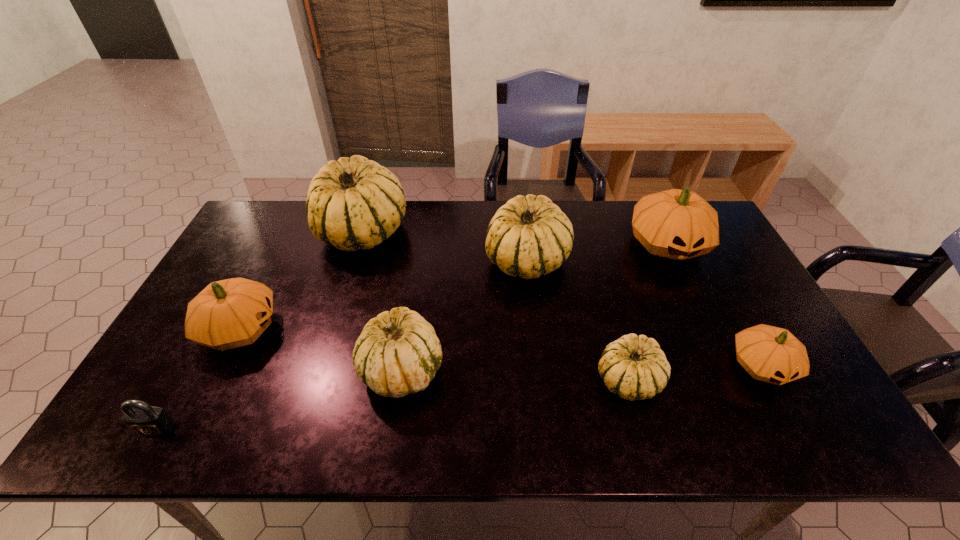
Identify which orange gourd is located as the second nearest to the biggest orange gourd. Please provide its 2D coordinates. Your answer should be formatted as a tuple, i.e. [(x, y)], where the tuple contains the x and y coordinates of a point satisfying the conditions above.

[(230, 313)]

You are a GUI agent. You are given a task and a screenshot of the screen. Output one action in this format:
    pyautogui.click(x=<x>, y=<y>)
    Task: Click on the orange gourd that is the second closest to the second smallest orange gourd
    The image size is (960, 540).
    Given the screenshot: What is the action you would take?
    pyautogui.click(x=770, y=354)

You are a GUI agent. You are given a task and a screenshot of the screen. Output one action in this format:
    pyautogui.click(x=<x>, y=<y>)
    Task: Click on the free location that satisfies the following two spatial constraints: 1. on the front side of the biggest white gourd; 2. on the right side of the fourth gourd from left to right
    Image resolution: width=960 pixels, height=540 pixels.
    Given the screenshot: What is the action you would take?
    pyautogui.click(x=354, y=260)

Locate an element on the screen. The width and height of the screenshot is (960, 540). vacant space that satisfies the following two spatial constraints: 1. on the side of the second biggest orange gourd with the carved face; 2. on the left side of the second smallest white gourd is located at coordinates (220, 369).